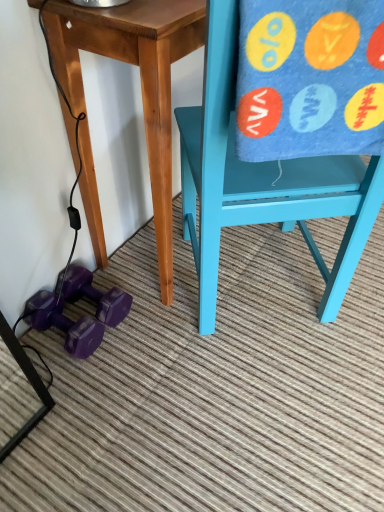
Question: Does matte blue chair at right have a greater height compared to purple rubber dumbbell at lower left, the second dumbbell in the top-to-bottom sequence?

Choices:
 (A) yes
 (B) no

Answer: (A)

Question: From a real-world perspective, is matte blue chair at right located higher than purple rubber dumbbell at lower left, the 1th dumbbell from the bottom?

Choices:
 (A) no
 (B) yes

Answer: (B)

Question: Is matte blue chair at right at the right side of purple rubber dumbbell at lower left, the 1th dumbbell from the bottom?

Choices:
 (A) yes
 (B) no

Answer: (A)

Question: Considering the relative sizes of matte blue chair at right and purple rubber dumbbell at lower left, the 1th dumbbell from the bottom, in the image provided, is matte blue chair at right smaller than purple rubber dumbbell at lower left, the 1th dumbbell from the bottom,?

Choices:
 (A) yes
 (B) no

Answer: (B)

Question: Is matte blue chair at right positioned before purple rubber dumbbell at lower left, the 1th dumbbell from the bottom?

Choices:
 (A) no
 (B) yes

Answer: (B)

Question: Is matte blue chair at right shorter than purple rubber dumbbell at lower left, the 1th dumbbell from the bottom?

Choices:
 (A) no
 (B) yes

Answer: (A)

Question: Can you confirm if purple rubber dumbbell at lower left, the second dumbbell in the top-to-bottom sequence, is taller than wooden table at center?

Choices:
 (A) yes
 (B) no

Answer: (B)

Question: Does purple rubber dumbbell at lower left, the second dumbbell in the top-to-bottom sequence, have a greater width compared to wooden table at center?

Choices:
 (A) no
 (B) yes

Answer: (A)

Question: From the image's perspective, does purple rubber dumbbell at lower left, the 1th dumbbell from the bottom, appear lower than wooden table at center?

Choices:
 (A) yes
 (B) no

Answer: (A)

Question: Is wooden table at center at the back of purple rubber dumbbell at lower left, the 1th dumbbell from the bottom?

Choices:
 (A) yes
 (B) no

Answer: (B)

Question: Is the depth of purple rubber dumbbell at lower left, the second dumbbell in the top-to-bottom sequence, greater than that of wooden table at center?

Choices:
 (A) yes
 (B) no

Answer: (A)

Question: From the image's perspective, does purple rubber dumbbell at lower left, the second dumbbell in the top-to-bottom sequence, appear higher than wooden table at center?

Choices:
 (A) no
 (B) yes

Answer: (A)

Question: Could you tell me if matte blue chair at right is turned towards wooden table at center?

Choices:
 (A) yes
 (B) no

Answer: (A)